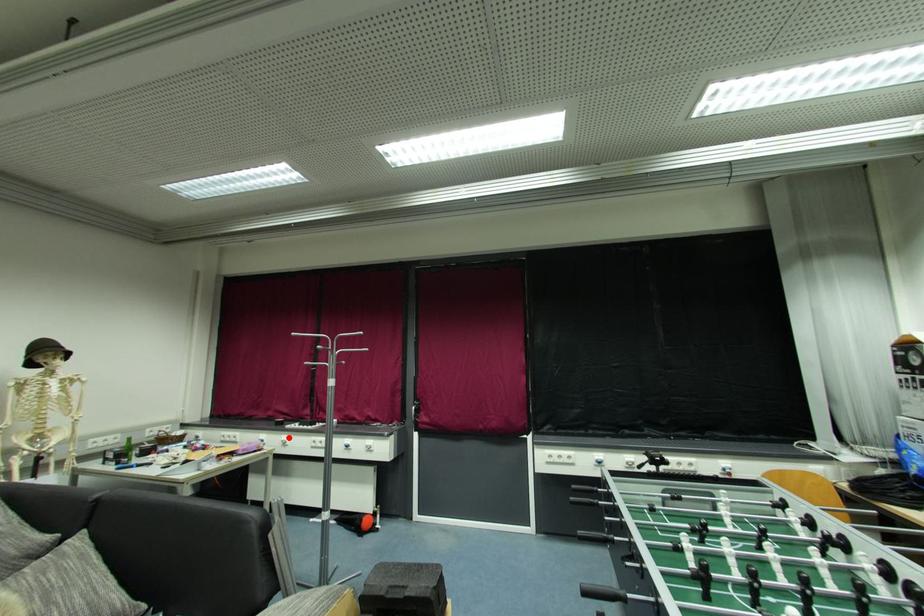
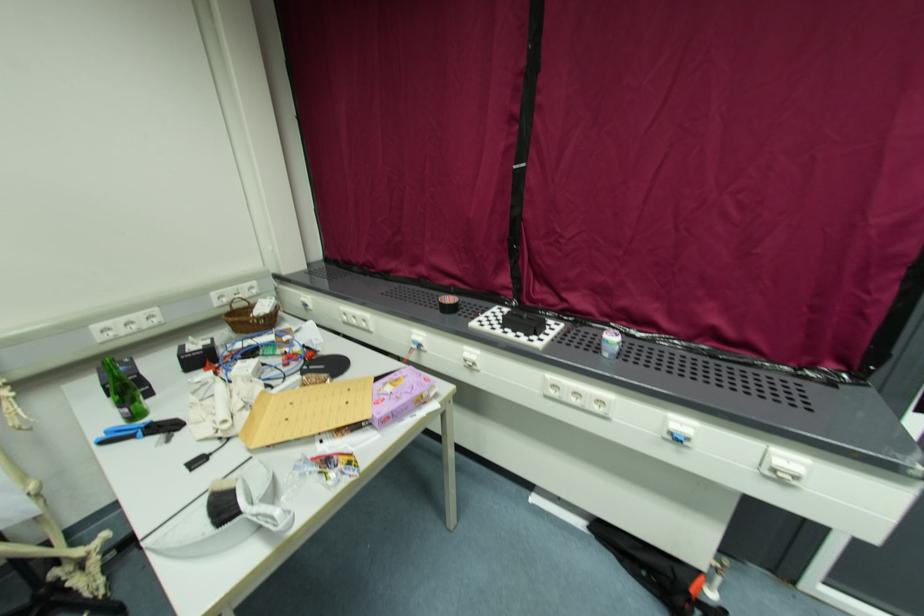
In the second image, find the point that corresponds to the highlighted location in the first image.

(476, 352)